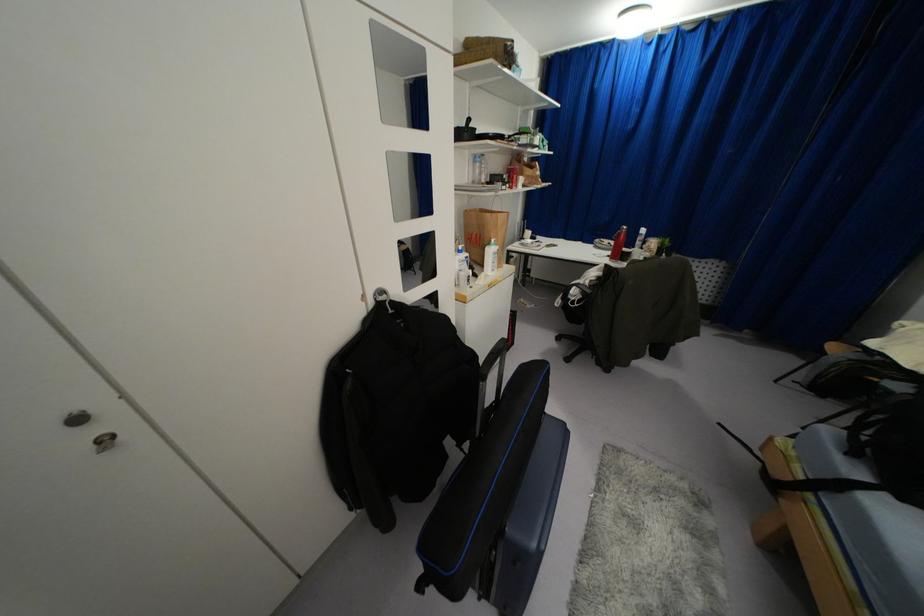
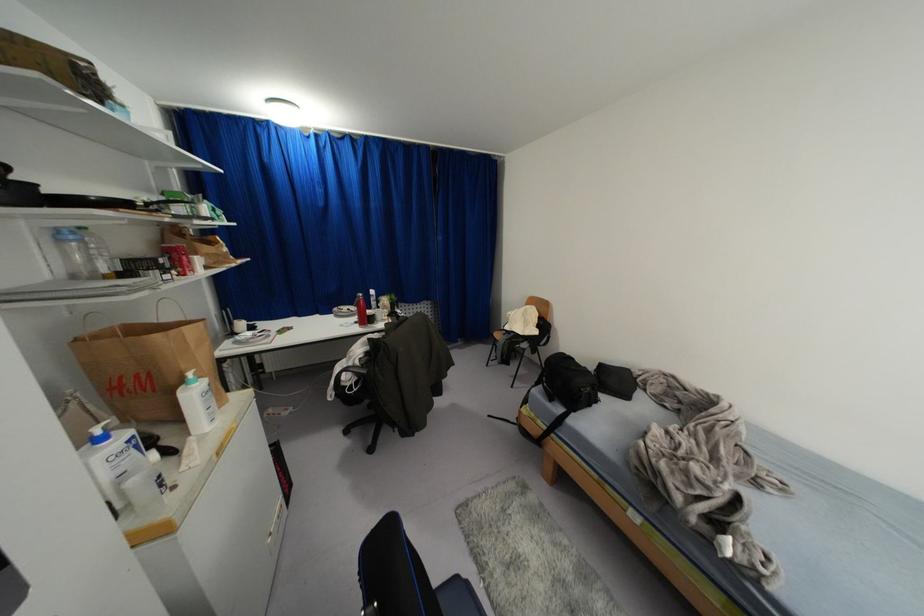
Locate, in the second image, the point that corresponds to pixel 459 246 in the first image.

(98, 431)